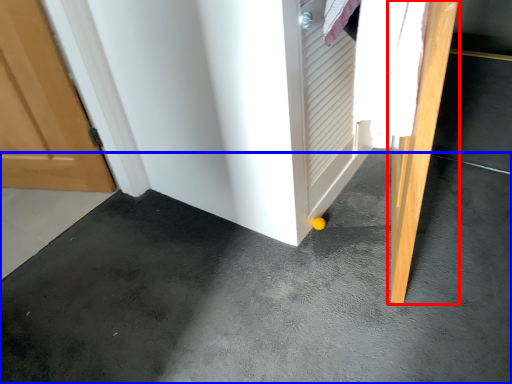
Question: Which object is further to the camera taking this photo, door (highlighted by a red box) or concrete (highlighted by a blue box)?

Choices:
 (A) door
 (B) concrete

Answer: (A)